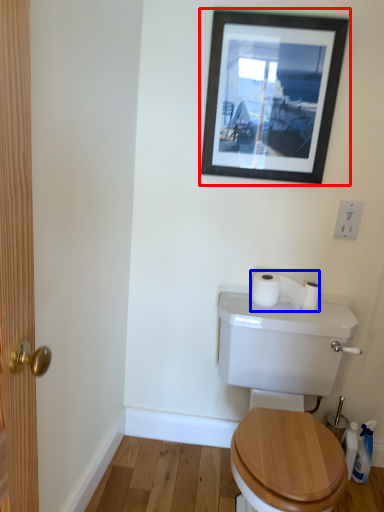
Question: Which point is further to the camera, picture frame (highlighted by a red box) or toilet paper (highlighted by a blue box)?

Choices:
 (A) picture frame
 (B) toilet paper

Answer: (B)